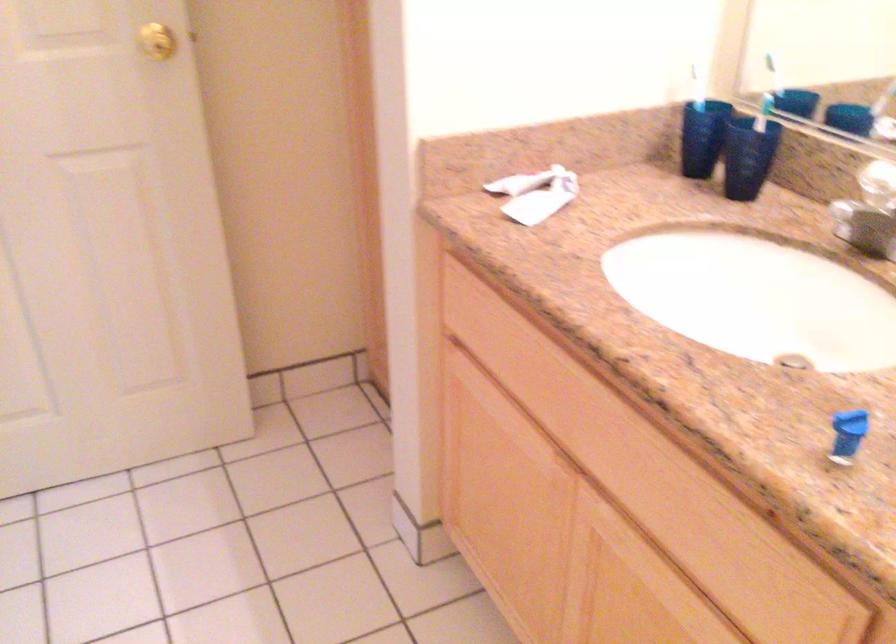
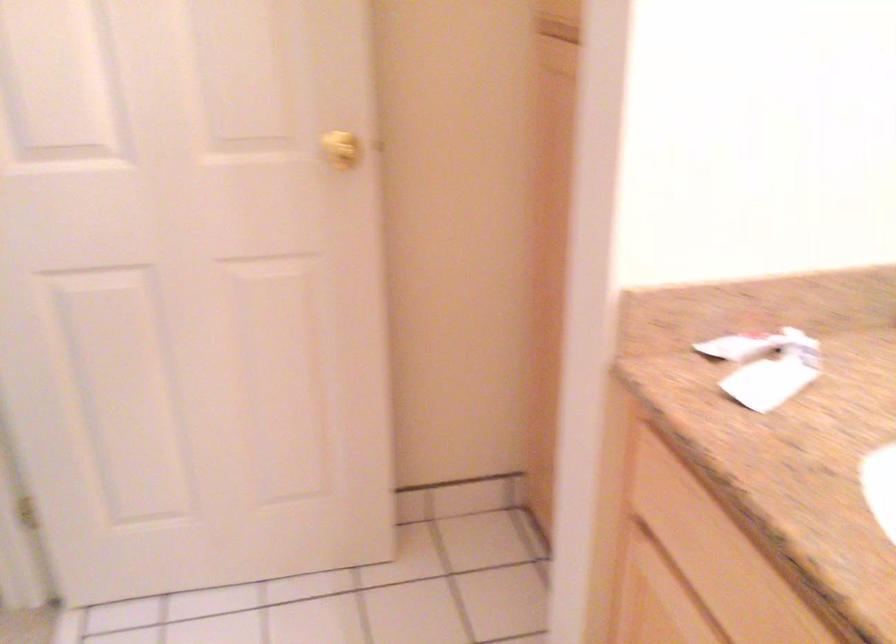
Find the pixel in the second image that matches (x=539, y=194) in the first image.

(764, 366)